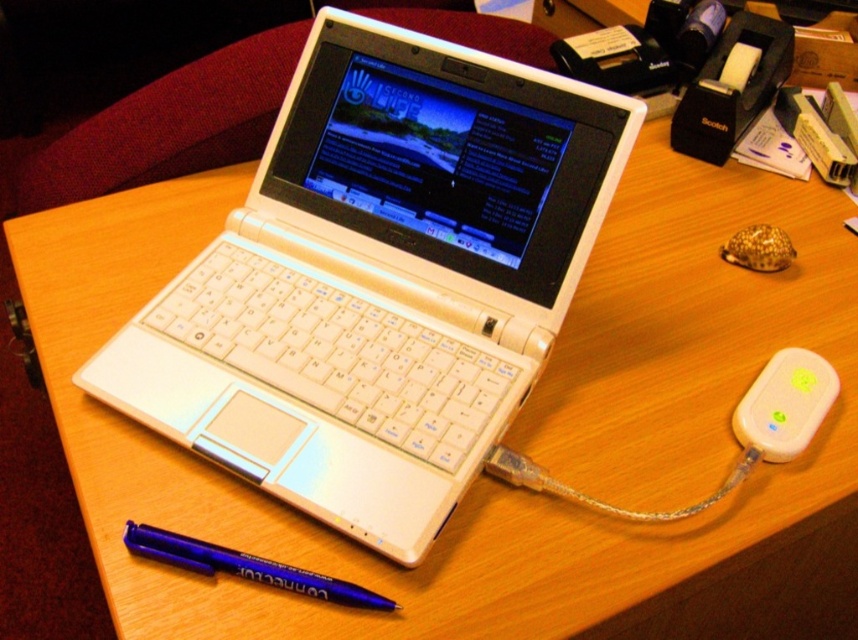
Question: Which point is farther to the camera?

Choices:
 (A) white plastic laptop at center
 (B) white plastic ipod at right
 (C) blue metallic pen at lower left

Answer: (B)

Question: Which of these objects is positioned closest to the white plastic laptop at center?

Choices:
 (A) white plastic ipod at right
 (B) blue metallic pen at lower left

Answer: (B)

Question: From the image, what is the correct spatial relationship of white plastic laptop at center in relation to white plastic ipod at right?

Choices:
 (A) right
 (B) left

Answer: (B)

Question: Which of the following is the farthest from the observer?

Choices:
 (A) white plastic ipod at right
 (B) blue metallic pen at lower left
 (C) white plastic laptop at center

Answer: (A)

Question: Does white plastic laptop at center have a greater width compared to blue metallic pen at lower left?

Choices:
 (A) no
 (B) yes

Answer: (B)

Question: Where is white plastic laptop at center located in relation to blue metallic pen at lower left in the image?

Choices:
 (A) left
 (B) right

Answer: (B)